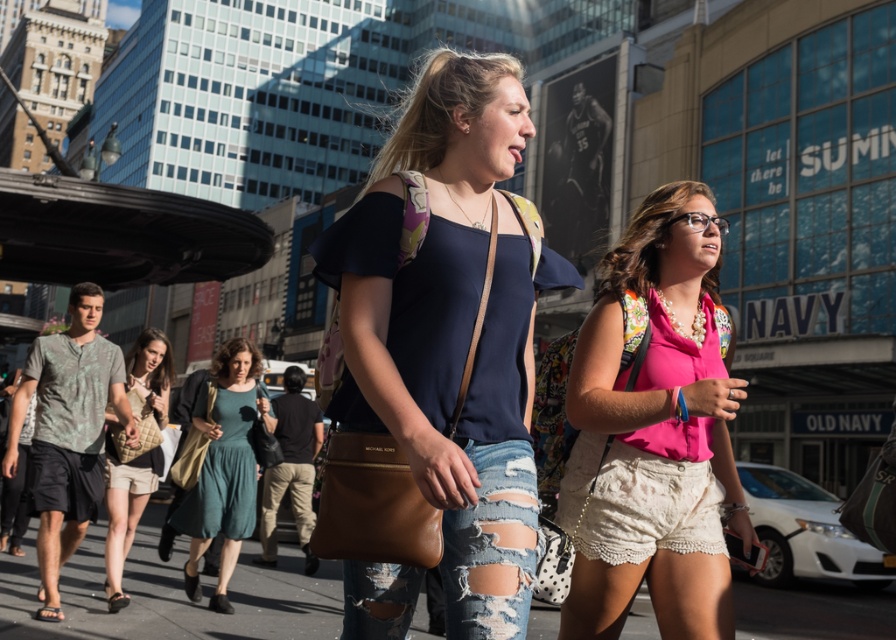
Can you confirm if matte blue top at center is positioned below teal fabric dress at center?

Actually, matte blue top at center is above teal fabric dress at center.

How distant is matte blue top at center from teal fabric dress at center?

matte blue top at center is 4.83 meters from teal fabric dress at center.

Is point (420, 420) behind point (230, 349)?

No, (420, 420) is in front of (230, 349).

This screenshot has width=896, height=640. I want to click on matte blue top at center, so click(450, 328).

Does matte blue top at center have a greater width compared to green textured shirt at left?

Yes, matte blue top at center is wider than green textured shirt at left.

Is point (457, 449) closer to camera compared to point (128, 406)?

Yes.

Locate an element on the screen. matte blue top at center is located at coordinates (450, 328).

This screenshot has width=896, height=640. Find the location of `matte blue top at center`. matte blue top at center is located at coordinates click(450, 328).

Who is higher up, matte blue top at center or pink fabric blouse at center?

matte blue top at center

Based on the photo, is matte blue top at center thinner than pink fabric blouse at center?

Incorrect, matte blue top at center's width is not less than pink fabric blouse at center's.

Does point (362, 387) come behind point (722, 608)?

No, (362, 387) is closer to viewer.

Find the location of a particular element. matte blue top at center is located at coordinates (450, 328).